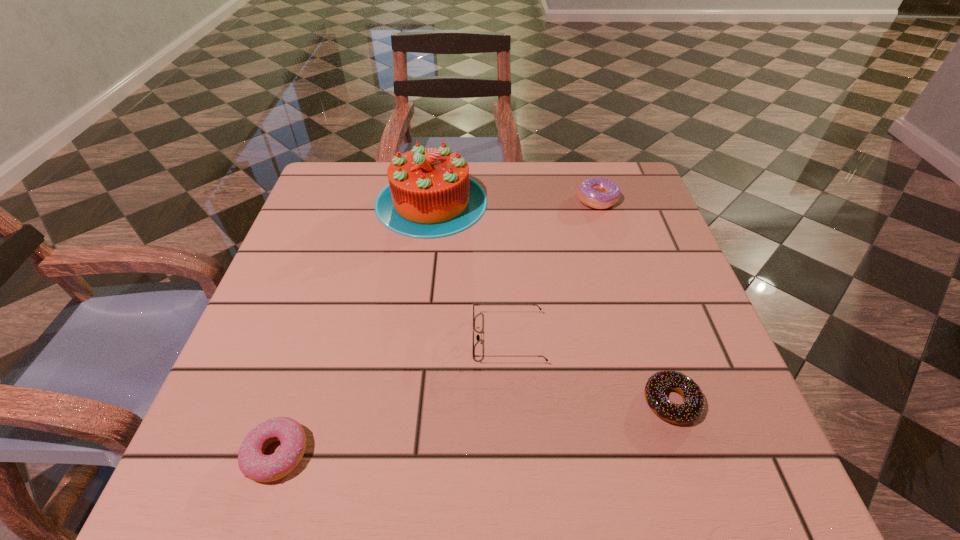
The image size is (960, 540). In order to click on free space located 0.070m on the right of the leftmost doughnut in this screenshot , I will do `click(354, 454)`.

You are a GUI agent. You are given a task and a screenshot of the screen. Output one action in this format:
    pyautogui.click(x=<x>, y=<y>)
    Task: Click on the vacant space located on the left of the shortest doughnut
    
    Given the screenshot: What is the action you would take?
    pyautogui.click(x=546, y=402)

Where is `cake present at the far edge`? cake present at the far edge is located at coordinates (430, 195).

Find the location of a particular element. The height and width of the screenshot is (540, 960). doughnut present at the far edge is located at coordinates (600, 193).

Locate an element on the screen. Image resolution: width=960 pixels, height=540 pixels. object positioned at the near edge is located at coordinates (254, 464).

Locate an element on the screen. This screenshot has width=960, height=540. object that is at the left edge is located at coordinates (254, 464).

Find the location of a particular element. object that is positioned at the near left corner is located at coordinates (254, 464).

At what (x,y) coordinates should I click in order to perform the action: click on object that is at the far right corner. Please return your answer as a coordinate pair (x, y). The image size is (960, 540). Looking at the image, I should click on (600, 193).

In the image, there is a desktop. Where is `free space at the far edge`? The width and height of the screenshot is (960, 540). free space at the far edge is located at coordinates (582, 208).

Identify the location of free space at the near edge. This screenshot has height=540, width=960. (619, 442).